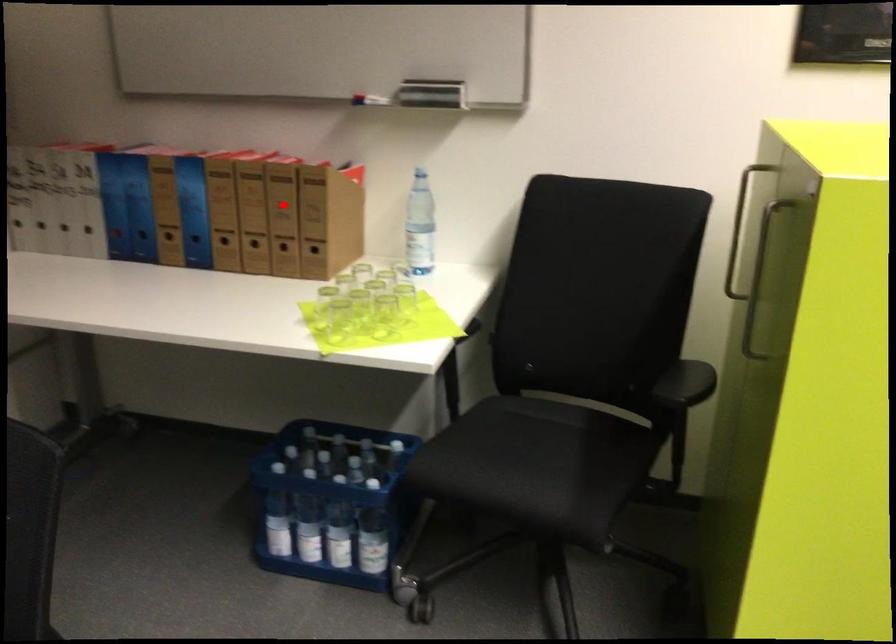
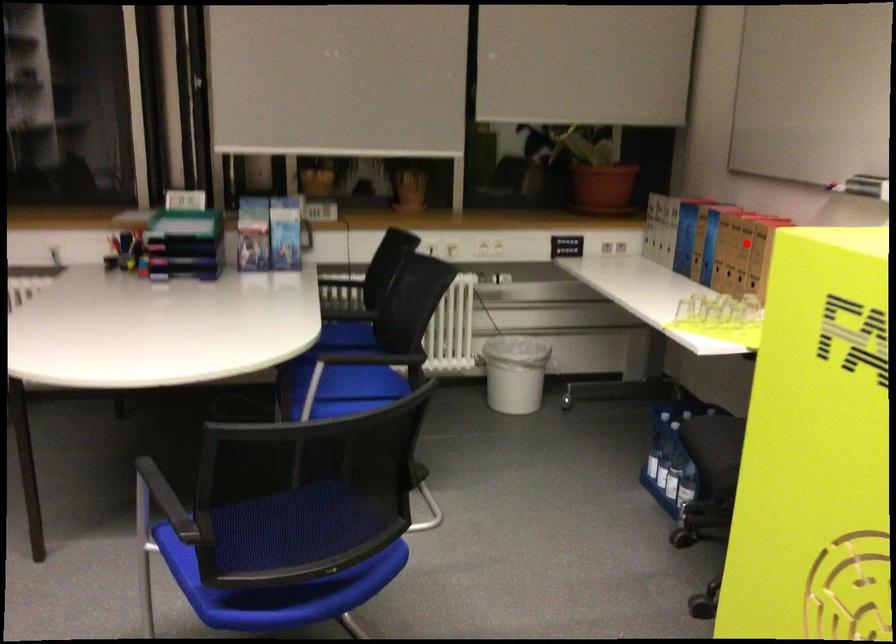
Looking at this image, I am providing you with two images of the same scene from different viewpoints. A red point is marked on the first image and another point is marked on the second image. Is the red point in image1 aligned with the point shown in image2?

Yes